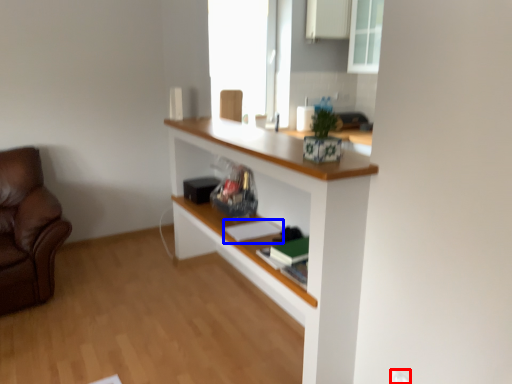
Question: Which point is closer to the camera, electric outlet (highlighted by a red box) or book (highlighted by a blue box)?

Choices:
 (A) electric outlet
 (B) book

Answer: (A)